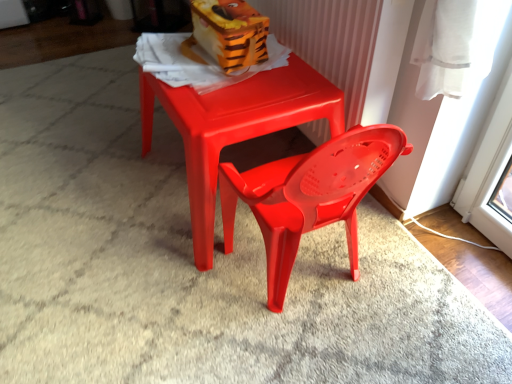
Question: From the image's perspective, does matte plastic table at center appear lower than orange plastic toy at upper center?

Choices:
 (A) yes
 (B) no

Answer: (A)

Question: Is matte plastic table at center looking in the opposite direction of orange plastic toy at upper center?

Choices:
 (A) no
 (B) yes

Answer: (A)

Question: Does matte plastic table at center come behind orange plastic toy at upper center?

Choices:
 (A) yes
 (B) no

Answer: (B)

Question: From a real-world perspective, is matte plastic table at center over orange plastic toy at upper center?

Choices:
 (A) yes
 (B) no

Answer: (B)

Question: From a real-world perspective, is matte plastic table at center below orange plastic toy at upper center?

Choices:
 (A) yes
 (B) no

Answer: (A)

Question: Does matte plastic table at center contain orange plastic toy at upper center?

Choices:
 (A) yes
 (B) no

Answer: (B)

Question: Is orange plastic toy at upper center behind matte plastic table at center?

Choices:
 (A) no
 (B) yes

Answer: (B)

Question: Is orange plastic toy at upper center bigger than matte plastic table at center?

Choices:
 (A) no
 (B) yes

Answer: (A)

Question: From the image's perspective, is orange plastic toy at upper center beneath matte plastic table at center?

Choices:
 (A) no
 (B) yes

Answer: (A)

Question: Does orange plastic toy at upper center appear on the right side of matte plastic table at center?

Choices:
 (A) yes
 (B) no

Answer: (B)

Question: Is orange plastic toy at upper center closer to camera compared to matte plastic table at center?

Choices:
 (A) yes
 (B) no

Answer: (B)

Question: Is orange plastic toy at upper center not within matte plastic table at center?

Choices:
 (A) yes
 (B) no

Answer: (A)

Question: Looking at the image, does matte plastic table at center seem bigger or smaller compared to orange plastic toy at upper center?

Choices:
 (A) small
 (B) big

Answer: (B)